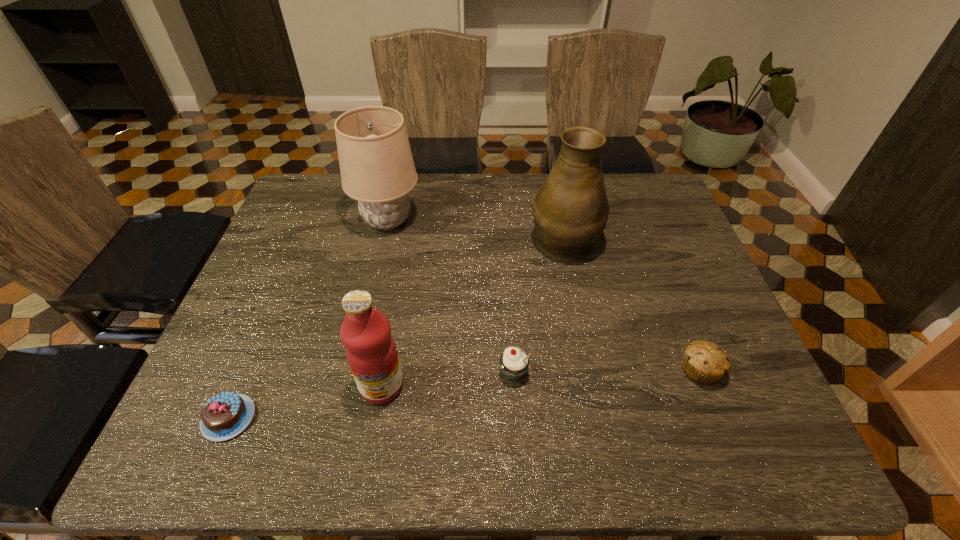
Identify the location of pitcher. This screenshot has height=540, width=960. (570, 211).

I want to click on lampshade, so click(377, 169).

Where is `fruit juice`? This screenshot has height=540, width=960. fruit juice is located at coordinates (371, 352).

Image resolution: width=960 pixels, height=540 pixels. What are the coordinates of `the fourth object from left to right` in the screenshot? It's located at (514, 363).

At what (x,y) coordinates should I click in order to perform the action: click on cupcake. Please return your answer as a coordinate pair (x, y). Looking at the image, I should click on (514, 363).

Where is `the rightmost object`? This screenshot has width=960, height=540. the rightmost object is located at coordinates (704, 362).

Locate an element on the screen. the fifth tallest object is located at coordinates (704, 362).

Locate an element on the screen. This screenshot has height=540, width=960. chocolate cake is located at coordinates (224, 416).

Identify the location of the shortest object. The height and width of the screenshot is (540, 960). (224, 416).

Find the location of a particular element. This screenshot has height=540, width=960. free space located 0.110m on the handle side of the fifth object from left to right is located at coordinates (555, 193).